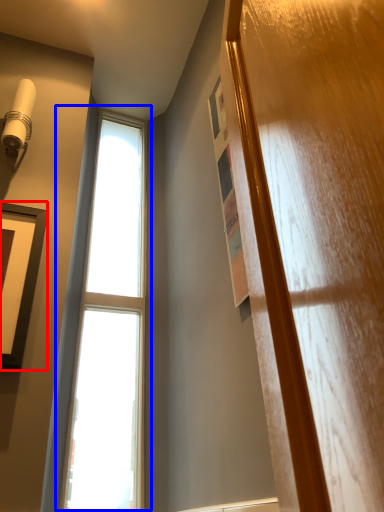
Question: Which object appears closest to the camera in this image, picture frame (highlighted by a red box) or window (highlighted by a blue box)?

Choices:
 (A) picture frame
 (B) window

Answer: (A)